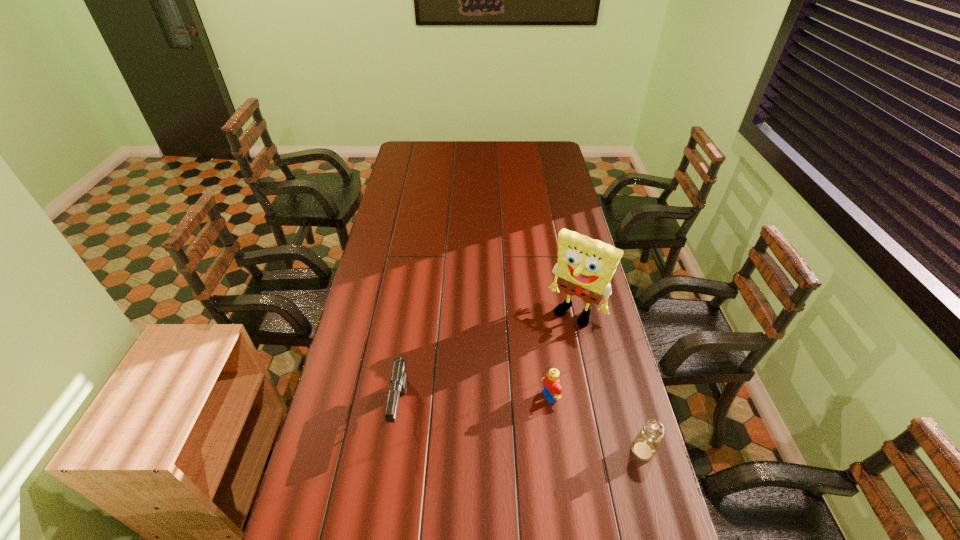
Locate an element on the screen. the leftmost object is located at coordinates (399, 381).

At what (x,y) coordinates should I click in order to perform the action: click on saltshaker. Please return your answer as a coordinate pair (x, y). Image resolution: width=960 pixels, height=540 pixels. Looking at the image, I should click on (645, 445).

Where is `Lego`? This screenshot has width=960, height=540. Lego is located at coordinates (552, 389).

Image resolution: width=960 pixels, height=540 pixels. In order to click on sponge in this screenshot , I will do `click(585, 267)`.

You are a GUI agent. You are given a task and a screenshot of the screen. Output one action in this format:
    pyautogui.click(x=<x>, y=<y>)
    Task: Click on the farthest object
    The image size is (960, 540).
    Given the screenshot: What is the action you would take?
    pyautogui.click(x=585, y=267)

Where is `free point located aim along the barrel of the pistol`? free point located aim along the barrel of the pistol is located at coordinates (386, 512).

Locate an element on the screen. The width and height of the screenshot is (960, 540). vacant space located on the left of the saltshaker is located at coordinates (540, 450).

Identify the location of vacant space situated 0.250m on the face of the second object from left to right. This screenshot has height=540, width=960. (468, 437).

What are the coordinates of `vacant space located 0.100m on the face of the second object from left to right` in the screenshot? It's located at (515, 415).

At what (x,y) coordinates should I click in order to perform the action: click on free space located on the face of the second object from left to right. Please return your answer as a coordinate pair (x, y). Looking at the image, I should click on (x=526, y=410).